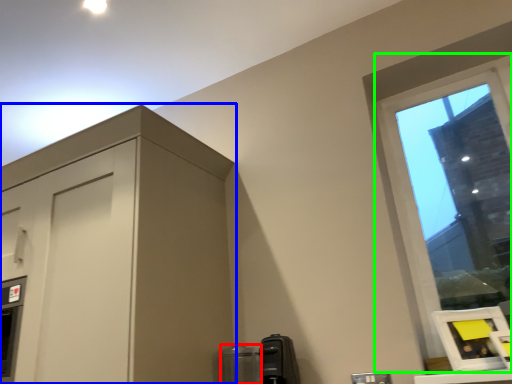
Question: Which object is positioned closest to appliance (highlighted by a red box)? Select from dresser (highlighted by a blue box) and window (highlighted by a green box).

Choices:
 (A) dresser
 (B) window

Answer: (A)